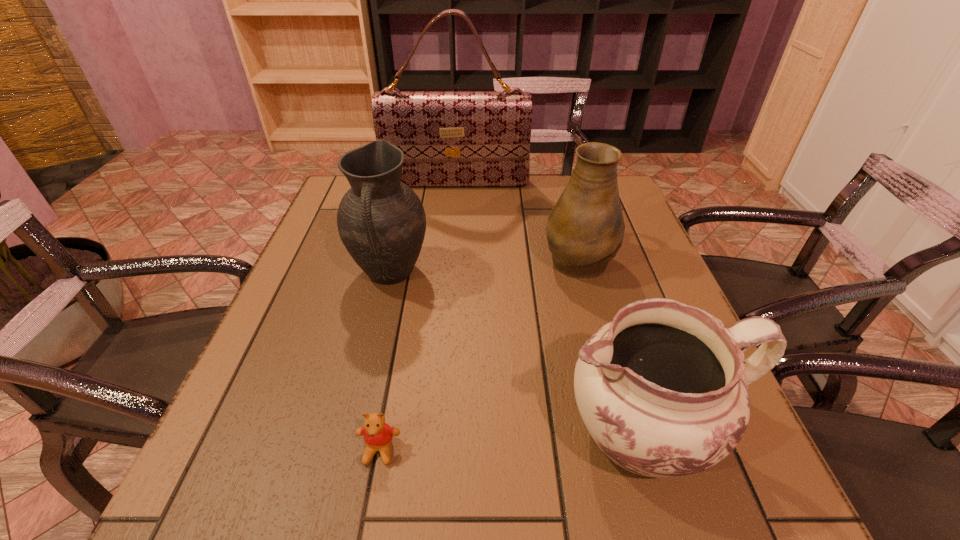
Find the location of a particular element. The image size is (960, 540). vacant space at the left edge is located at coordinates 355,268.

At what (x,y) coordinates should I click in order to perform the action: click on vacant area at the near left corner of the desktop. Please return your answer as a coordinate pair (x, y). This screenshot has width=960, height=540. Looking at the image, I should click on (283, 506).

I want to click on free spot between the teddy bear and the leftmost pitcher, so click(x=385, y=362).

Identify the location of vacant space in between the shortest object and the handbag. (418, 317).

The width and height of the screenshot is (960, 540). Find the location of `free space between the farthest object and the shortest pitcher`. free space between the farthest object and the shortest pitcher is located at coordinates (552, 307).

Find the location of a particular element. This screenshot has width=960, height=540. empty space that is in between the farthest object and the shortest pitcher is located at coordinates (552, 307).

This screenshot has height=540, width=960. What are the coordinates of `unoccupied area between the shortest object and the leftmost pitcher` in the screenshot? It's located at (385, 362).

Locate an element on the screen. empty space that is in between the leftmost pitcher and the shortest pitcher is located at coordinates (519, 352).

You are a GUI agent. You are given a task and a screenshot of the screen. Output one action in this format:
    pyautogui.click(x=<x>, y=<y>)
    Task: Click on the object that is the closest to the shortest pitcher
    The image size is (960, 540).
    Given the screenshot: What is the action you would take?
    pyautogui.click(x=585, y=229)

The image size is (960, 540). I want to click on object that is the second closest one to the nearest pitcher, so click(x=378, y=435).